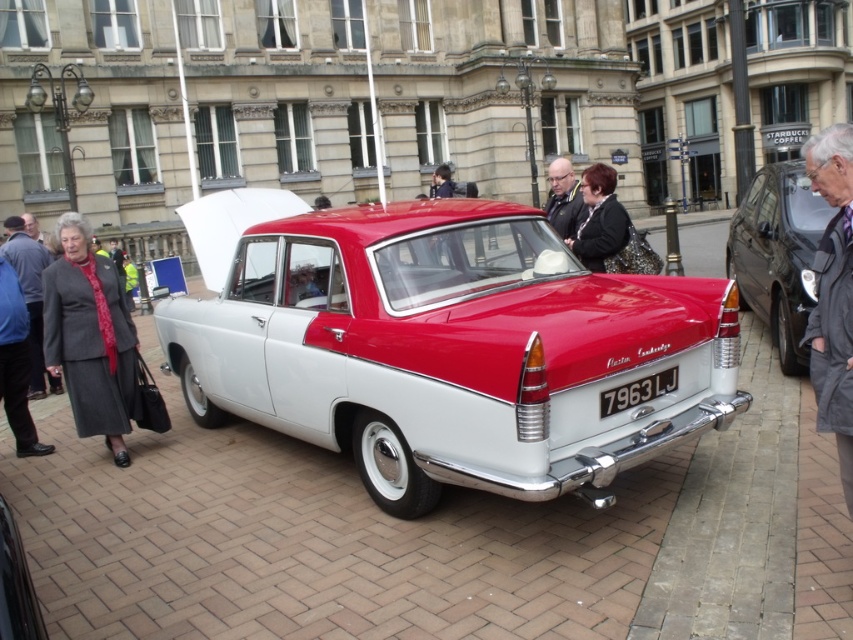
You are standing in front of the vintage car and want to place a gray wool coat at lower left on the shiny white car at center. Is the coat within reach from your current position?

The shiny white car at center is located below the gray wool coat at lower left, so the coat is positioned lower and closer to the car. Therefore, the coat is within reach to be placed on the shiny white car at center.

You are a delivery person standing at the camera position and need to deliver a package to the shiny black sedan at right. The package requires a distance of at least 6 meters to safely place it. Is the current distance sufficient?

The shiny black sedan at right is 5.60 meters away from camera. Since the required distance is 6 meters, the current distance is insufficient. You need to move back 0.40 meters to ensure safety.